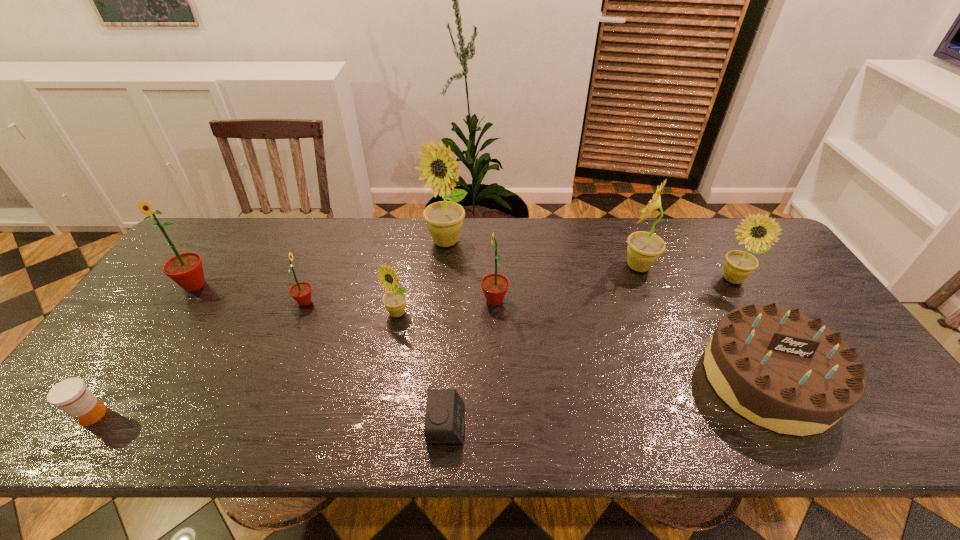
Find the location of a particular element. The width and height of the screenshot is (960, 540). vacant space located on the label of the ninth tallest object is located at coordinates (268, 415).

Identify the location of vacant area situated on the front-facing side of the shortest object. The width and height of the screenshot is (960, 540). (596, 424).

Identify the location of birthday cake located at the near edge. The height and width of the screenshot is (540, 960). (783, 371).

You are a GUI agent. You are given a task and a screenshot of the screen. Output one action in this format:
    pyautogui.click(x=<x>, y=<y>)
    Task: Click on the medicine present at the near edge
    This screenshot has height=540, width=960.
    Given the screenshot: What is the action you would take?
    pyautogui.click(x=71, y=395)

Where is `alarm clock that is at the near edge`? Image resolution: width=960 pixels, height=540 pixels. alarm clock that is at the near edge is located at coordinates (444, 421).

Where is `sunflower that is at the left edge`? The height and width of the screenshot is (540, 960). sunflower that is at the left edge is located at coordinates (186, 269).

Locate an element on the screen. Image resolution: width=960 pixels, height=540 pixels. medicine present at the left edge is located at coordinates (71, 395).

Find the location of `sunflower that is at the right edge`. sunflower that is at the right edge is located at coordinates (738, 265).

This screenshot has height=540, width=960. I want to click on birthday cake that is at the right edge, so click(783, 371).

This screenshot has height=540, width=960. What are the coordinates of `object that is at the near left corner` in the screenshot? It's located at (71, 395).